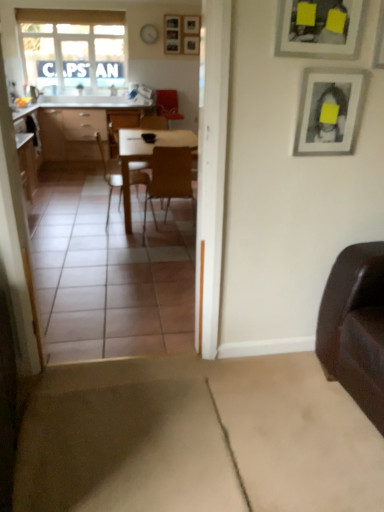
I want to click on velvet red armchair at center, so click(168, 104).

This screenshot has height=512, width=384. What do you see at coordinates (329, 111) in the screenshot?
I see `matte silver picture frame at upper right, the second picture frame when ordered from back to front` at bounding box center [329, 111].

Identify the location of translucent fabric window at upper left. (72, 46).

Identify the location of picture frame that is the 1st one when counting forward from the translucent fabric window at upper left. The height and width of the screenshot is (512, 384). (329, 111).

Based on the photo, is translucent fabric window at upper left looking in the opposite direction of matte silver picture frame at upper right, arranged as the third picture frame when viewed from the left?

No, matte silver picture frame at upper right, arranged as the third picture frame when viewed from the left, is not at the back of translucent fabric window at upper left.

Looking at the image, does translucent fabric window at upper left seem bigger or smaller compared to matte silver picture frame at upper right, positioned as the 1th picture frame in right-to-left order?

translucent fabric window at upper left is bigger than matte silver picture frame at upper right, positioned as the 1th picture frame in right-to-left order.

Does point (115, 12) come farther from viewer compared to point (315, 138)?

Yes, point (115, 12) is farther from viewer.

Which of these two, matte black picture frame at upper right, the second picture frame positioned from the top, or matte wood desk at center, is thinner?

matte black picture frame at upper right, the second picture frame positioned from the top.

In the scene shown: Is matte black picture frame at upper right, which is the second picture frame in left-to-right order, placed right next to matte wood desk at center?

matte black picture frame at upper right, which is the second picture frame in left-to-right order, is not next to matte wood desk at center, and they're not touching.

Is point (294, 18) less distant than point (112, 126)?

Yes, it is in front of point (112, 126).

From the image's perspective, which object appears higher, matte black picture frame at upper right, acting as the second picture frame starting from the right, or matte wood desk at center?

matte wood desk at center, from the image's perspective.

From the image's perspective, who appears lower, wooden table at center or matte silver picture frame at upper right, the first picture frame positioned from the bottom?

matte silver picture frame at upper right, the first picture frame positioned from the bottom, is shown below in the image.

From a real-world perspective, who is located higher, wooden table at center or matte silver picture frame at upper right, positioned as the 1th picture frame in right-to-left order?

matte silver picture frame at upper right, positioned as the 1th picture frame in right-to-left order, from a real-world perspective.

Considering the positions of points (126, 213) and (330, 109), is point (126, 213) closer to camera compared to point (330, 109)?

No, it is behind (330, 109).

Does point (334, 129) come behind point (170, 177)?

No, it is not.

In terms of height, does matte silver picture frame at upper right, the second picture frame when ordered from back to front, look taller or shorter compared to wooden at center, which appears as the first chair when viewed from the right?

matte silver picture frame at upper right, the second picture frame when ordered from back to front, is shorter than wooden at center, which appears as the first chair when viewed from the right.

Considering the positions of objects matte silver picture frame at upper right, placed as the third picture frame when sorted from top to bottom, and wooden at center, which appears as the first chair when viewed from the right, in the image provided, who is more to the left, matte silver picture frame at upper right, placed as the third picture frame when sorted from top to bottom, or wooden at center, which appears as the first chair when viewed from the right,?

From the viewer's perspective, wooden at center, which appears as the first chair when viewed from the right, appears more on the left side.

From the image's perspective, who appears lower, matte silver picture frame at upper right, the second picture frame when ordered from back to front, or wooden at center, which is the second chair in left-to-right order?

wooden at center, which is the second chair in left-to-right order, from the image's perspective.

Does velvet red armchair at center turn towards wooden picture frame at upper center, the third picture frame in the bottom-to-top sequence?

No, velvet red armchair at center is not oriented towards wooden picture frame at upper center, the third picture frame in the bottom-to-top sequence.

From the image's perspective, between velvet red armchair at center and wooden picture frame at upper center, placed as the 1th picture frame when sorted from top to bottom, who is located below?

velvet red armchair at center.

Are velvet red armchair at center and wooden picture frame at upper center, the third picture frame viewed from the right, beside each other?

velvet red armchair at center and wooden picture frame at upper center, the third picture frame viewed from the right, are not in contact.

Measure the distance between velvet red armchair at center and wooden picture frame at upper center, the third picture frame in the bottom-to-top sequence.

velvet red armchair at center and wooden picture frame at upper center, the third picture frame in the bottom-to-top sequence, are 28.77 inches apart from each other.

From the image's perspective, is matte wood desk at center located above or below translucent fabric window at upper left?

Based on their image positions, matte wood desk at center is located beneath translucent fabric window at upper left.

Is matte wood desk at center thinner than translucent fabric window at upper left?

No.

Which of these two, matte wood desk at center or translucent fabric window at upper left, stands shorter?

Standing shorter between the two is matte wood desk at center.

Between matte wood desk at center and translucent fabric window at upper left, which one has smaller size?

translucent fabric window at upper left.

How many degrees apart are the facing directions of wooden at center, which is the second chair in left-to-right order, and velvet red armchair at center?

wooden at center, which is the second chair in left-to-right order, and velvet red armchair at center are facing 176 degrees away from each other.

From a real-world perspective, which is physically below, wooden at center, which appears as the first chair when viewed from the right, or velvet red armchair at center?

From a 3D spatial view, wooden at center, which appears as the first chair when viewed from the right, is below.

Between wooden at center, which is the second chair in left-to-right order, and velvet red armchair at center, which one has more height?

wooden at center, which is the second chair in left-to-right order.

In order to click on picture frame that is the 3rd object to the right of the translucent fabric window at upper left, starting at the anchor in this screenshot , I will do `click(329, 111)`.

Where is `cabinetry below the matte black picture frame at upper right, which is the second picture frame in left-to-right order (from a real-world perspective)`? This screenshot has width=384, height=512. cabinetry below the matte black picture frame at upper right, which is the second picture frame in left-to-right order (from a real-world perspective) is located at coordinates (83, 122).

Which object lies further to the anchor point wooden chair at center, which ranks as the 1th chair in left-to-right order, wooden at center, which appears as the first chair when viewed from the right, or velvet red armchair at center?

Among the two, wooden at center, which appears as the first chair when viewed from the right, is located further to wooden chair at center, which ranks as the 1th chair in left-to-right order.

Which object lies further to the anchor point wooden chair at center, which is counted as the 2th chair, starting from the right, wooden picture frame at upper center, the third picture frame viewed from the right, or matte silver picture frame at upper right, the second picture frame when ordered from back to front?

matte silver picture frame at upper right, the second picture frame when ordered from back to front, is further to wooden chair at center, which is counted as the 2th chair, starting from the right.

Which object lies nearer to the anchor point velvet red armchair at center, matte wood desk at center or wooden picture frame at upper center, the third picture frame viewed from the right?

wooden picture frame at upper center, the third picture frame viewed from the right, is positioned closer to the anchor velvet red armchair at center.

Based on their spatial positions, is matte silver picture frame at upper right, placed as the third picture frame when sorted from top to bottom, or translucent fabric window at upper left closer to matte black picture frame at upper right, the 1th picture frame in the front-to-back sequence?

The object closer to matte black picture frame at upper right, the 1th picture frame in the front-to-back sequence, is matte silver picture frame at upper right, placed as the third picture frame when sorted from top to bottom.

From the image, which object appears to be nearer to wooden table at center, wooden chair at center, which ranks as the 1th chair in left-to-right order, or matte black picture frame at upper right, which is the second picture frame in left-to-right order?

Among the two, wooden chair at center, which ranks as the 1th chair in left-to-right order, is located nearer to wooden table at center.

Consider the image. Which object lies nearer to the anchor point wooden table at center, matte black picture frame at upper right, which is counted as the second picture frame, starting from the bottom, or matte silver picture frame at upper right, the second picture frame when ordered from back to front?

The object closer to wooden table at center is matte silver picture frame at upper right, the second picture frame when ordered from back to front.

From the image, which object appears to be farther from velvet red armchair at center, wooden picture frame at upper center, positioned as the 1th picture frame in back-to-front order, or wooden at center, which appears as the first chair when viewed from the right?

wooden at center, which appears as the first chair when viewed from the right, lies further to velvet red armchair at center than the other object.

When comparing their distances from wooden table at center, does wooden at center, which is the second chair in left-to-right order, or matte wood desk at center seem further?

matte wood desk at center.

Identify the location of table between wooden at center, which appears as the first chair when viewed from the right, and wooden picture frame at upper center, the first picture frame positioned from the left, from front to back. (146, 155).

The image size is (384, 512). Identify the location of armchair between matte silver picture frame at upper right, the first picture frame positioned from the bottom, and wooden picture frame at upper center, the third picture frame in the bottom-to-top sequence, in the front-back direction. (168, 104).

Identify the location of armchair situated between translucent fabric window at upper left and wooden picture frame at upper center, the third picture frame in the bottom-to-top sequence, from left to right. The height and width of the screenshot is (512, 384). (168, 104).

Image resolution: width=384 pixels, height=512 pixels. I want to click on armchair between wooden picture frame at upper center, the first picture frame positioned from the left, and matte wood desk at center vertically, so click(x=168, y=104).